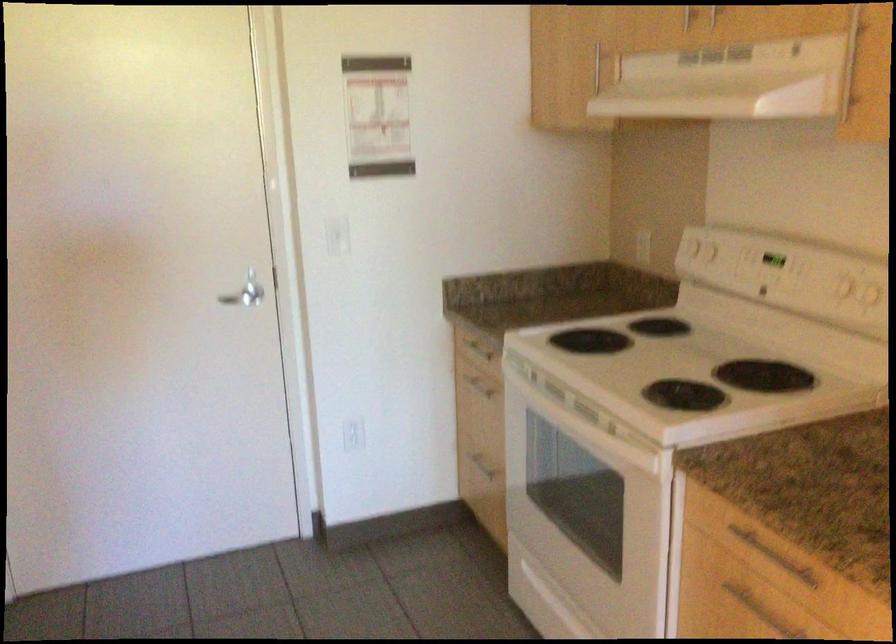
I want to click on white light switch, so click(352, 433).